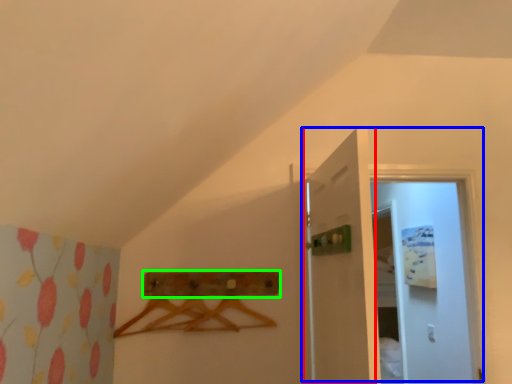
Question: Which object is positioned farthest from door (highlighted by a red box)? Select from door (highlighted by a blue box) and drawer (highlighted by a green box).

Choices:
 (A) door
 (B) drawer

Answer: (A)